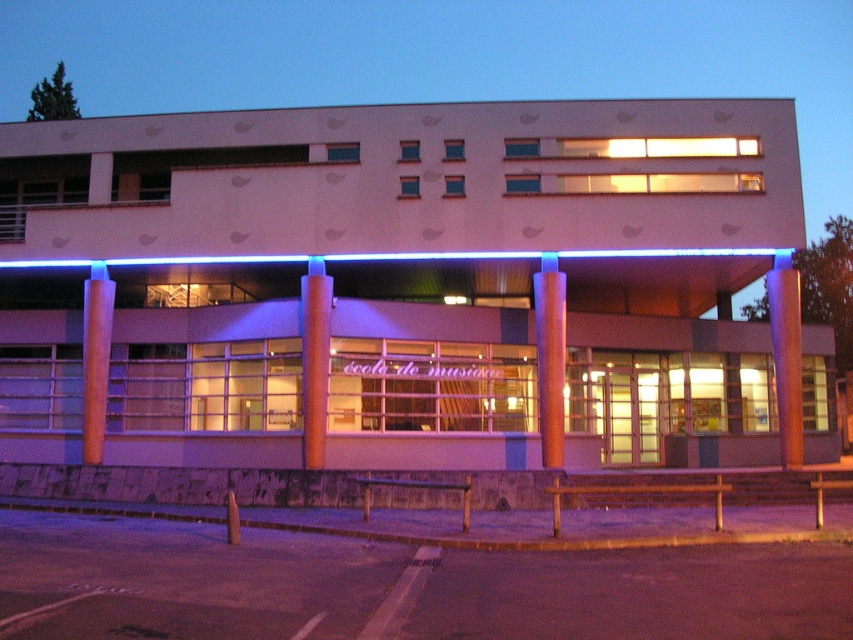
You are a visitor approaching the entrance of the modern music school building. You notice two pillars supporting the entrance area. Which pillar, the orange glossy pillar at right or the smooth wood pillar at center, has a smaller diameter?

The orange glossy pillar at right is thinner than the smooth wood pillar at center, so it has a smaller diameter.

You are standing in front of the building and want to enter the music school. Which pillar, the orange glossy pillar at right or the brown polished wood pillar at left, is closer to you as you approach the entrance?

The orange glossy pillar at right is closer to the viewer than the brown polished wood pillar at left, so it is closer as you approach the entrance.

In the scene shown: You are a visitor arriving at the music school and need to choose between two pillars to lean your coat on. The orange glossy pillar at right and the smooth wood pillar at center. Which pillar is smaller in size?

The orange glossy pillar at right is smaller in size compared to the smooth wood pillar at center.